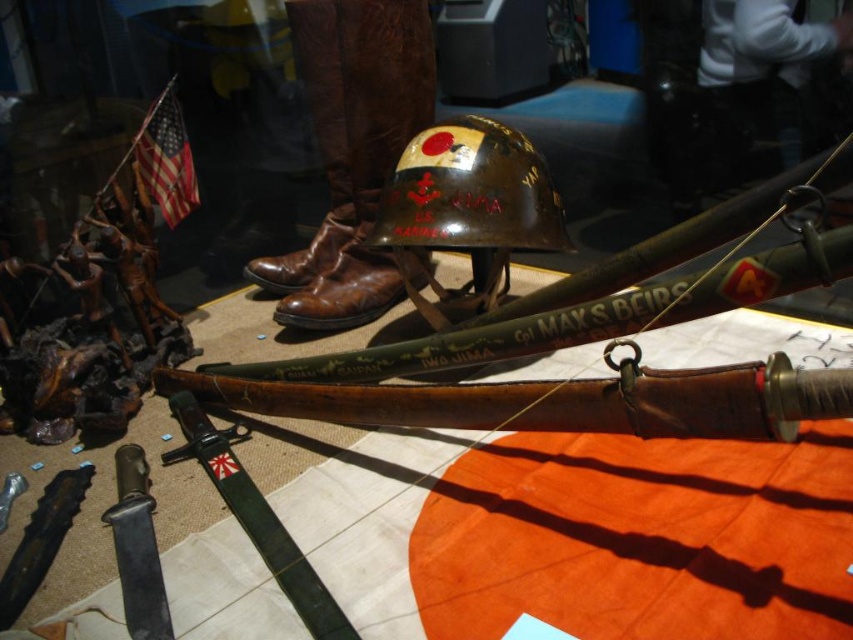
Question: Which of the following is the closest to the observer?

Choices:
 (A) (120, 504)
 (B) (367, 86)
 (C) (196, 416)
 (D) (511, 237)

Answer: (A)

Question: Does shiny brown helmet at center have a smaller size compared to matte black knife at lower left?

Choices:
 (A) yes
 (B) no

Answer: (B)

Question: Can you confirm if brown leather boot at center is positioned to the left of matte black knife at lower left?

Choices:
 (A) yes
 (B) no

Answer: (B)

Question: Which point is closer to the camera taking this photo?

Choices:
 (A) (137, 444)
 (B) (402, 173)

Answer: (A)

Question: Which object is positioned farthest from the matte black knife at lower left?

Choices:
 (A) green leather sword at center
 (B) brown leather boot at center
 (C) shiny brown helmet at center

Answer: (B)

Question: Does shiny brown helmet at center have a larger size compared to matte black knife at lower left?

Choices:
 (A) no
 (B) yes

Answer: (B)